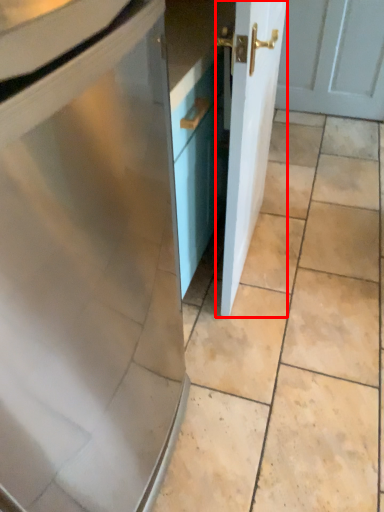
Question: From the image's perspective, what is the correct spatial relationship of door (annotated by the red box) in relation to ceramic tile?

Choices:
 (A) above
 (B) below

Answer: (A)